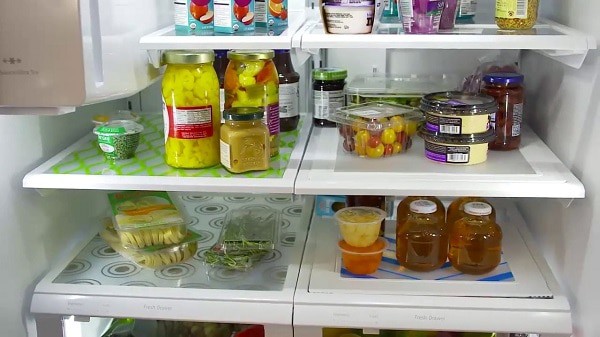
You are a GUI agent. You are given a task and a screenshot of the screen. Output one action in this format:
    pyautogui.click(x=<x>, y=<y>)
    Task: Click on the left side of fridge
    The width and height of the screenshot is (600, 337).
    Given the screenshot: What is the action you would take?
    pyautogui.click(x=42, y=243), pyautogui.click(x=29, y=142)